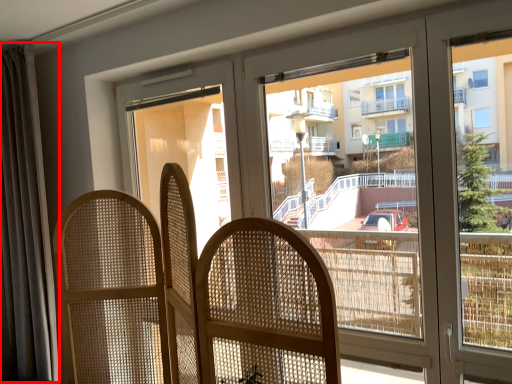
Question: From the image's perspective, what is the correct spatial positioning of curtain (annotated by the red box) in reference to rocking chair?

Choices:
 (A) below
 (B) above

Answer: (B)